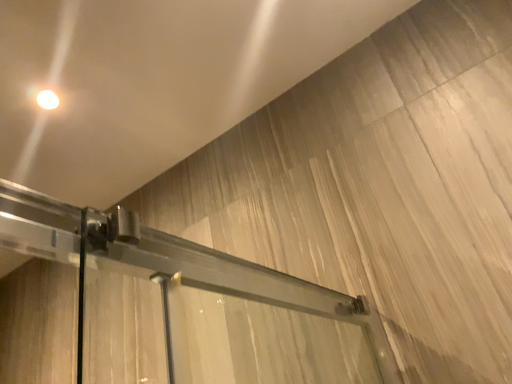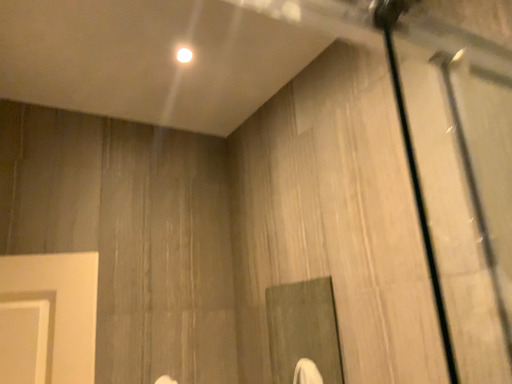
Question: How did the camera likely rotate when shooting the video?

Choices:
 (A) rotated right
 (B) rotated left

Answer: (B)